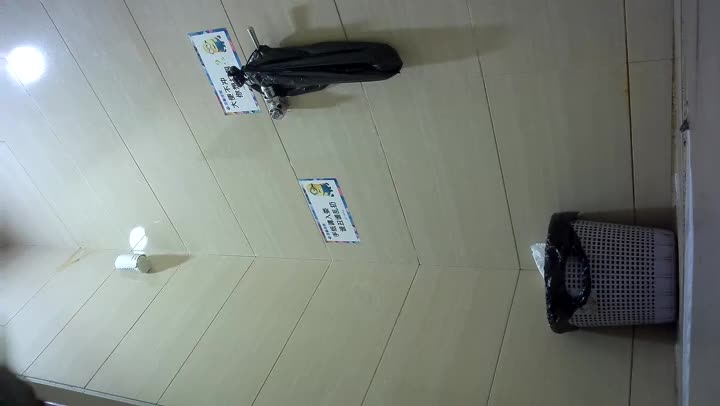
Locate an element on the screen. The image size is (720, 406). trash bag is located at coordinates (570, 239).